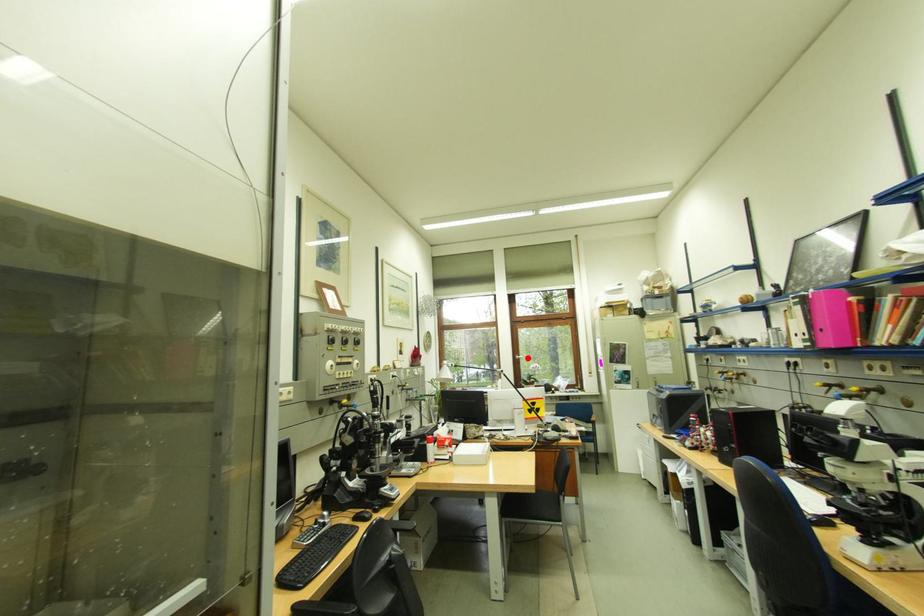
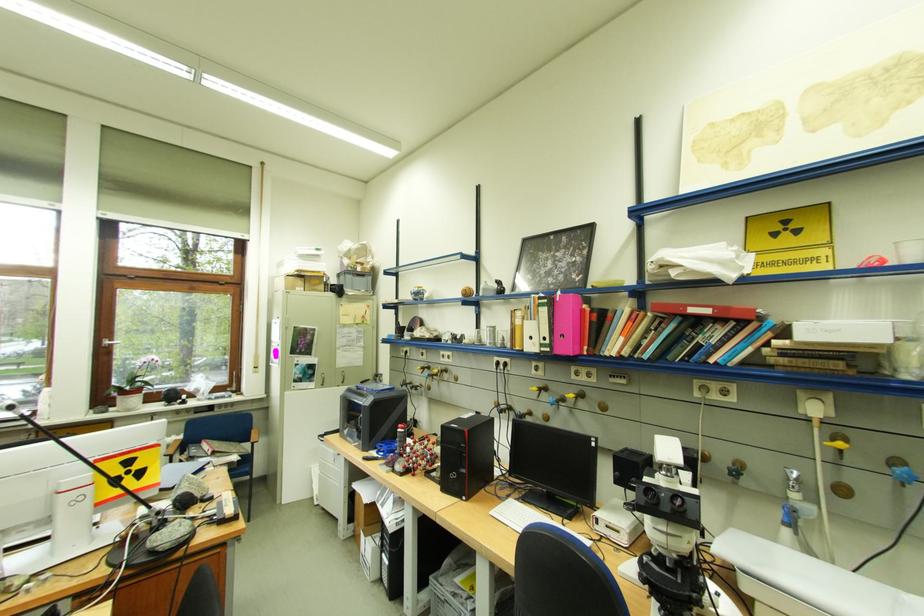
Where in the second image is the point corresponding to the highlighted location from the first image?

(117, 342)